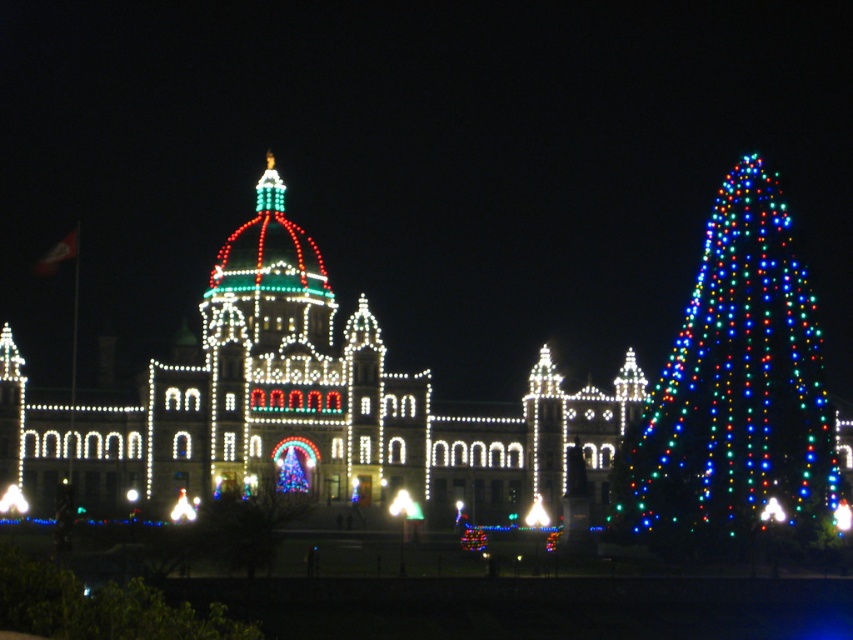
You are standing in front of the grand building with Christmas lights. You want to take a photo that includes both the building and the multicolored lights Christmas tree at right. Based on their positions, where should you position yourself to ensure both are in the frame?

Since the multicolored lights Christmas tree at right is located at point (735, 394), you should position yourself to the left of the building to include both the building and the tree in your photo.

You are planning to take a photo of the illuminated stone building at center and the illuminated plastic tree at center. Which object should you focus on first if you want to capture both in a single frame without moving the camera?

You should focus on the illuminated stone building at center first because it is larger in size than the illuminated plastic tree at center, so it will occupy more space in the frame and ensure both are visible.